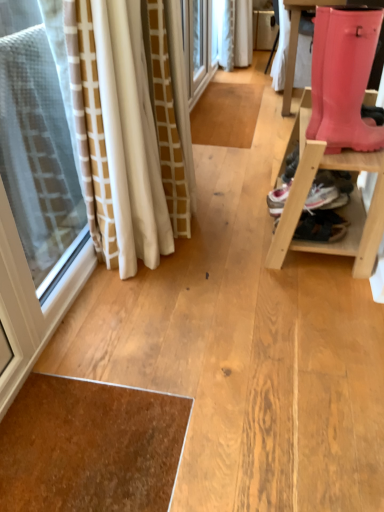
Locate an element on the screen. This screenshot has height=512, width=384. pink rubber boot at right is located at coordinates (343, 78).

Describe the element at coordinates (343, 78) in the screenshot. I see `pink rubber boot at right` at that location.

This screenshot has height=512, width=384. What do you see at coordinates (339, 210) in the screenshot? I see `pink rubber boot at right` at bounding box center [339, 210].

Measure the distance between pink rubber boot at right and camera.

pink rubber boot at right is 4.50 feet away from camera.

Find the location of a particular element. pink rubber boot at right is located at coordinates (339, 210).

In order to click on pink rubber boot at right in this screenshot , I will do `click(343, 78)`.

Can you confirm if pink rubber boot at right is positioned to the left of pink rubber boot at right?

Incorrect, pink rubber boot at right is not on the left side of pink rubber boot at right.

Is the depth of pink rubber boot at right greater than that of pink rubber boot at right?

Yes, it is behind pink rubber boot at right.

Which is closer, (279,231) or (372,142)?

Point (372,142)

From the image's perspective, would you say pink rubber boot at right is shown under pink rubber boot at right?

Indeed, from the image's perspective, pink rubber boot at right is shown beneath pink rubber boot at right.

From a real-world perspective, is pink rubber boot at right over pink rubber boot at right?

Incorrect, from a real-world perspective, pink rubber boot at right is lower than pink rubber boot at right.

Which of these two, pink rubber boot at right or pink rubber boot at right, is thinner?

Thinner between the two is pink rubber boot at right.

Which of these two, pink rubber boot at right or pink rubber boot at right, stands taller?

Standing taller between the two is pink rubber boot at right.

Is pink rubber boot at right bigger than pink rubber boot at right?

Indeed, pink rubber boot at right has a larger size compared to pink rubber boot at right.

Is pink rubber boot at right outside of pink rubber boot at right?

pink rubber boot at right lies outside pink rubber boot at right's area.

Is pink rubber boot at right placed right next to pink rubber boot at right?

No.

Could you tell me if pink rubber boot at right is facing pink rubber boot at right?

No, pink rubber boot at right is not oriented towards pink rubber boot at right.

Locate an element on the screen. Image resolution: width=384 pixels, height=512 pixels. furniture that appears on the right of pink rubber boot at right is located at coordinates (339, 210).

Based on their positions, is pink rubber boot at right located to the left or right of pink rubber boot at right?

pink rubber boot at right is positioned on pink rubber boot at right's left side.

Consider the image. Which is in front, pink rubber boot at right or pink rubber boot at right?

pink rubber boot at right is more forward.

Between point (322, 80) and point (368, 271), which one is positioned behind?

The point (368, 271) is farther.

From the image's perspective, is pink rubber boot at right on top of pink rubber boot at right?

Correct, pink rubber boot at right appears higher than pink rubber boot at right in the image.

From a real-world perspective, is pink rubber boot at right under pink rubber boot at right?

Incorrect, from a real-world perspective, pink rubber boot at right is higher than pink rubber boot at right.

In terms of width, does pink rubber boot at right look wider or thinner when compared to pink rubber boot at right?

pink rubber boot at right is thinner than pink rubber boot at right.

Can you confirm if pink rubber boot at right is shorter than pink rubber boot at right?

Indeed, pink rubber boot at right has a lesser height compared to pink rubber boot at right.

From the picture: Between pink rubber boot at right and pink rubber boot at right, which one has smaller size?

With smaller size is pink rubber boot at right.

Is pink rubber boot at right completely or partially inside pink rubber boot at right?

No, pink rubber boot at right is not surrounded by pink rubber boot at right.

Is pink rubber boot at right not close to pink rubber boot at right?

pink rubber boot at right is actually quite close to pink rubber boot at right.

Does pink rubber boot at right turn towards pink rubber boot at right?

No.

You are a GUI agent. You are given a task and a screenshot of the screen. Output one action in this format:
    pyautogui.click(x=<x>, y=<y>)
    Task: Click on the furniture below the pink rubber boot at right (from a real-world perspective)
    This screenshot has height=512, width=384.
    Given the screenshot: What is the action you would take?
    pyautogui.click(x=339, y=210)

This screenshot has height=512, width=384. Find the location of `footwear in front of the pink rubber boot at right`. footwear in front of the pink rubber boot at right is located at coordinates (343, 78).

Find the location of `footwear above the pink rubber boot at right (from a real-world perspective)`. footwear above the pink rubber boot at right (from a real-world perspective) is located at coordinates 343,78.